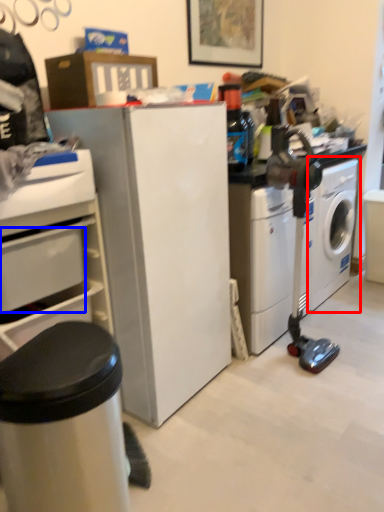
Question: Which object is closer to the camera taking this photo, washing machine (highlighted by a red box) or drawer (highlighted by a blue box)?

Choices:
 (A) washing machine
 (B) drawer

Answer: (B)